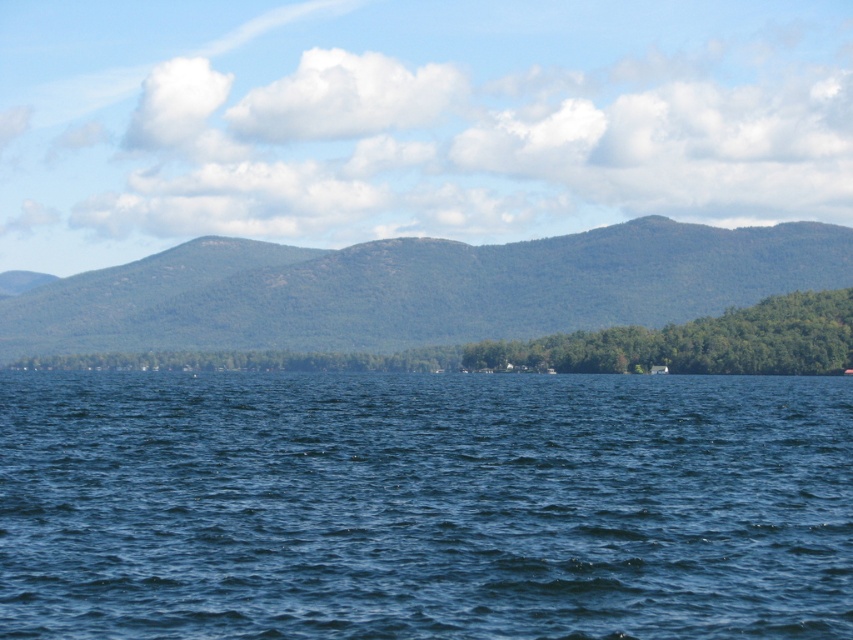
You are a photographer planning to capture the entire scene in one shot. Given that the camera sensor can only accommodate objects up to a certain width, which object between the blue liquid water at center and the green forested mountain at center would require more careful framing to ensure it fits within the camera sensor?

The green forested mountain at center requires more careful framing because its width is greater than the blue liquid water at center, so it might exceed the camera sensor capacity if not positioned properly.

Looking at this image, based on the scene description, which object takes up more area in the image between the blue liquid water at center and the green forested mountain at center?

The green forested mountain at center occupies more area than the blue liquid water at center in the image.

You are a hiker standing at the edge of the lake. You want to take a photo that includes both the blue liquid water at center and the green forested mountain at center. Which object should appear closer to the camera in your photo?

The blue liquid water at center should appear closer to the camera in your photo because it is in front of the green forested mountain at center.